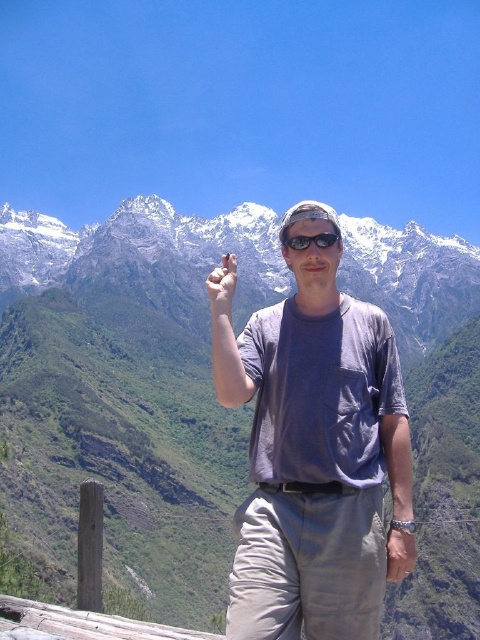
Looking at this image, can you confirm if snowy mountain range at upper center is shorter than gray cotton t-shirt at center?

In fact, snowy mountain range at upper center may be taller than gray cotton t-shirt at center.

Which is more to the left, snowy mountain range at upper center or gray cotton t-shirt at center?

snowy mountain range at upper center is more to the left.

Between point (3, 166) and point (385, 564), which one is positioned in front?

Point (385, 564) is in front.

The height and width of the screenshot is (640, 480). I want to click on snowy mountain range at upper center, so click(x=242, y=106).

Is snowy granite mountain range at upper center to the right of black matte sunglasses at center from the viewer's perspective?

No, snowy granite mountain range at upper center is not to the right of black matte sunglasses at center.

Is point (191, 308) more distant than point (313, 236)?

Yes, it is behind point (313, 236).

Where is `snowy granite mountain range at upper center`? This screenshot has width=480, height=640. snowy granite mountain range at upper center is located at coordinates (144, 257).

What do you see at coordinates (129, 390) in the screenshot?
I see `green grassy mountain at upper center` at bounding box center [129, 390].

Between green grassy mountain at upper center and snowy granite mountain range at upper center, which one is positioned higher?

snowy granite mountain range at upper center

Between point (117, 291) and point (140, 289), which one is positioned in front?

Positioned in front is point (117, 291).

Find the location of a particular element. The image size is (480, 640). green grassy mountain at upper center is located at coordinates (129, 390).